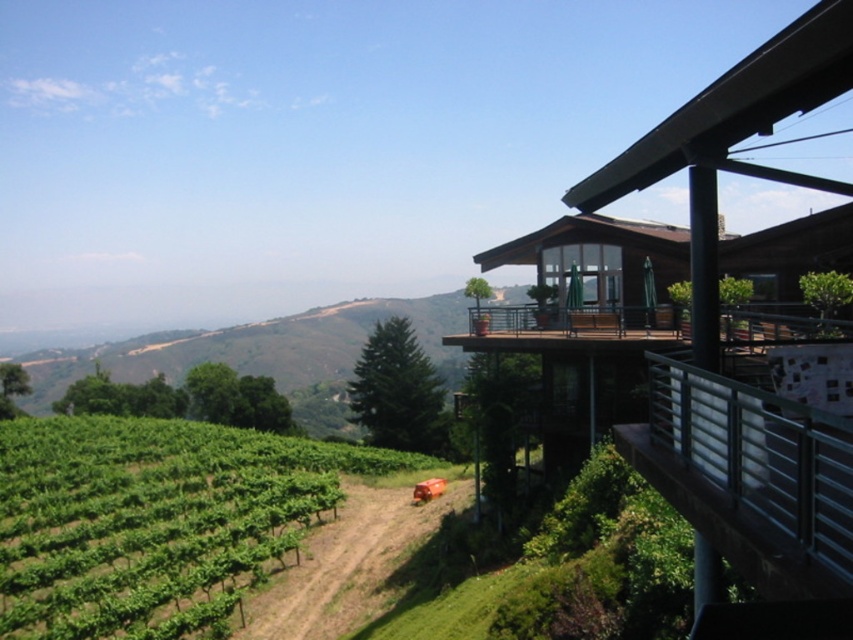
Is green leafy vineyard at lower left to the right of metallic silver railing at upper right from the viewer's perspective?

No, green leafy vineyard at lower left is not to the right of metallic silver railing at upper right.

Where is `green leafy vineyard at lower left`? green leafy vineyard at lower left is located at coordinates (155, 520).

Where is `green leafy vineyard at lower left`? green leafy vineyard at lower left is located at coordinates (155, 520).

Does brown dirt track at lower center have a greater width compared to wooden deck at upper right?

Incorrect, brown dirt track at lower center's width does not surpass wooden deck at upper right's.

Between brown dirt track at lower center and wooden deck at upper right, which one appears on the right side from the viewer's perspective?

wooden deck at upper right

Find the location of a particular element. brown dirt track at lower center is located at coordinates pos(347,563).

Who is more forward, (x=165, y=445) or (x=390, y=497)?

Point (x=390, y=497) is in front.

Identify the location of green leafy vineyard at lower left. (155, 520).